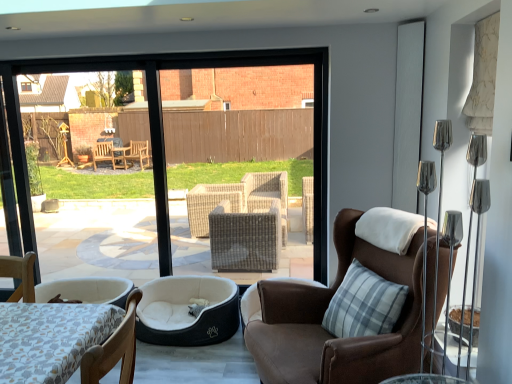
Identify the location of wooden chair at lower left, the 1th chair in the left-to-right sequence. (112, 348).

Image resolution: width=512 pixels, height=384 pixels. I want to click on dark gray plush dog bed at lower left, so click(x=187, y=311).

Is white textured screen door at upper right with brown leather chair at center, marked as the first chair in a back-to-front arrangement?

No, white textured screen door at upper right is not in contact with brown leather chair at center, marked as the first chair in a back-to-front arrangement.

Does white textured screen door at upper right have a larger size compared to brown leather chair at center, arranged as the 2th chair when viewed from the front?

Incorrect, white textured screen door at upper right is not larger than brown leather chair at center, arranged as the 2th chair when viewed from the front.

In the image, is white textured screen door at upper right positioned in front of or behind brown leather chair at center, which is counted as the second chair, starting from the left?

In the image, white textured screen door at upper right appears behind brown leather chair at center, which is counted as the second chair, starting from the left.

How many degrees apart are the facing directions of white textured screen door at upper right and brown leather chair at center, which is counted as the second chair, starting from the left?

The facing directions of white textured screen door at upper right and brown leather chair at center, which is counted as the second chair, starting from the left, are 18.2 degrees apart.

Does wooden chair at lower left, the 1th chair viewed from the front, contain brown leather chair at center, marked as the first chair in a back-to-front arrangement?

No, wooden chair at lower left, the 1th chair viewed from the front, does not contain brown leather chair at center, marked as the first chair in a back-to-front arrangement.

Who is smaller, wooden chair at lower left, the 2th chair positioned from the right, or brown leather chair at center, arranged as the first chair when viewed from the right?

wooden chair at lower left, the 2th chair positioned from the right.

Where is `chair above the brown leather chair at center, which is counted as the second chair, starting from the left (from a real-world perspective)`? chair above the brown leather chair at center, which is counted as the second chair, starting from the left (from a real-world perspective) is located at coordinates (112, 348).

Is white textured screen door at upper right in front of wooden chair at lower left, the 2th chair positioned from the back?

No, it is not.

At what (x,y) coordinates should I click in order to perform the action: click on the 2nd chair in front of the white textured screen door at upper right, starting your count from the anchor. Please return your answer as a coordinate pair (x, y). The image size is (512, 384). Looking at the image, I should click on (112, 348).

Which object is thinner, white textured screen door at upper right or wooden chair at lower left, the 2th chair positioned from the back?

white textured screen door at upper right.

Is white textured screen door at upper right placed right next to dark gray plush dog bed at lower left?

No.

From the image's perspective, is white textured screen door at upper right below dark gray plush dog bed at lower left?

Actually, white textured screen door at upper right appears above dark gray plush dog bed at lower left in the image.

Considering the relative positions of white textured screen door at upper right and dark gray plush dog bed at lower left in the image provided, is white textured screen door at upper right to the right of dark gray plush dog bed at lower left from the viewer's perspective?

Yes.

In the image, is white textured screen door at upper right positioned in front of or behind dark gray plush dog bed at lower left?

Clearly, white textured screen door at upper right is in front of dark gray plush dog bed at lower left.

Is dark gray plush dog bed at lower left wider than wooden chair at lower left, the 1th chair in the left-to-right sequence?

Correct, the width of dark gray plush dog bed at lower left exceeds that of wooden chair at lower left, the 1th chair in the left-to-right sequence.

Which object is positioned more to the right, dark gray plush dog bed at lower left or wooden chair at lower left, the 1th chair in the left-to-right sequence?

dark gray plush dog bed at lower left.

Locate an element on the screen. The width and height of the screenshot is (512, 384). the 2nd chair in front of the dark gray plush dog bed at lower left is located at coordinates (112, 348).

From the image's perspective, relative to wooden chair at lower left, the 1th chair in the left-to-right sequence, is dark gray plush dog bed at lower left above or below?

Clearly, from the image's perspective, dark gray plush dog bed at lower left is below wooden chair at lower left, the 1th chair in the left-to-right sequence.

Find the location of a particular element. chair that is the 2nd one when counting forward from the dark gray plush dog bed at lower left is located at coordinates (112, 348).

From a real-world perspective, does wooden chair at lower left, the 1th chair viewed from the front, stand above dark gray plush dog bed at lower left?

Yes, from a real-world perspective, wooden chair at lower left, the 1th chair viewed from the front, is over dark gray plush dog bed at lower left

Which is more to the right, wooden chair at lower left, the 1th chair viewed from the front, or dark gray plush dog bed at lower left?

Positioned to the right is dark gray plush dog bed at lower left.

Which object is closer to the camera taking this photo, wooden chair at lower left, the 1th chair in the left-to-right sequence, or dark gray plush dog bed at lower left?

wooden chair at lower left, the 1th chair in the left-to-right sequence, is more forward.

Can we say brown leather chair at center, arranged as the 2th chair when viewed from the front, lies outside white textured screen door at upper right?

Absolutely, brown leather chair at center, arranged as the 2th chair when viewed from the front, is external to white textured screen door at upper right.

From the image's perspective, relative to white textured screen door at upper right, is brown leather chair at center, arranged as the 2th chair when viewed from the front, above or below?

brown leather chair at center, arranged as the 2th chair when viewed from the front, is below white textured screen door at upper right.

Considering their positions, is brown leather chair at center, marked as the first chair in a back-to-front arrangement, located in front of or behind white textured screen door at upper right?

Clearly, brown leather chair at center, marked as the first chair in a back-to-front arrangement, is in front of white textured screen door at upper right.

How distant is brown leather chair at center, marked as the first chair in a back-to-front arrangement, from white textured screen door at upper right?

brown leather chair at center, marked as the first chair in a back-to-front arrangement, and white textured screen door at upper right are 1.09 meters apart from each other.

Where is `the 1st chair counting from the left of the white textured screen door at upper right`? the 1st chair counting from the left of the white textured screen door at upper right is located at coordinates (323, 316).

At what (x,y) coordinates should I click in order to perform the action: click on chair in front of the brown leather chair at center, arranged as the 2th chair when viewed from the front. Please return your answer as a coordinate pair (x, y). Looking at the image, I should click on (112, 348).

Considering their positions, is dark gray plush dog bed at lower left positioned further to wooden chair at lower left, the 2th chair positioned from the right, than brown leather chair at center, arranged as the first chair when viewed from the right?

Based on the image, dark gray plush dog bed at lower left appears to be further to wooden chair at lower left, the 2th chair positioned from the right.

Looking at the image, which one is located closer to dark gray plush dog bed at lower left, wooden chair at lower left, the 1th chair in the left-to-right sequence, or white textured screen door at upper right?

Among the two, wooden chair at lower left, the 1th chair in the left-to-right sequence, is located nearer to dark gray plush dog bed at lower left.

Considering their positions, is dark gray plush dog bed at lower left positioned further to brown leather chair at center, which is counted as the second chair, starting from the left, than white textured screen door at upper right?

The object further to brown leather chair at center, which is counted as the second chair, starting from the left, is white textured screen door at upper right.

Which object lies nearer to the anchor point white textured screen door at upper right, brown leather chair at center, arranged as the first chair when viewed from the right, or wooden chair at lower left, the 1th chair viewed from the front?

Based on the image, brown leather chair at center, arranged as the first chair when viewed from the right, appears to be nearer to white textured screen door at upper right.

When comparing their distances from brown leather chair at center, arranged as the first chair when viewed from the right, does dark gray plush dog bed at lower left or wooden chair at lower left, the 1th chair in the left-to-right sequence, seem further?

The object further to brown leather chair at center, arranged as the first chair when viewed from the right, is dark gray plush dog bed at lower left.

Which object lies nearer to the anchor point wooden chair at lower left, the 1th chair viewed from the front, white textured screen door at upper right or dark gray plush dog bed at lower left?

dark gray plush dog bed at lower left is positioned closer to the anchor wooden chair at lower left, the 1th chair viewed from the front.

Based on their spatial positions, is wooden chair at lower left, the 2th chair positioned from the right, or brown leather chair at center, which is counted as the second chair, starting from the left, further from dark gray plush dog bed at lower left?

Among the two, wooden chair at lower left, the 2th chair positioned from the right, is located further to dark gray plush dog bed at lower left.

When comparing their distances from dark gray plush dog bed at lower left, does white textured screen door at upper right or brown leather chair at center, marked as the first chair in a back-to-front arrangement, seem closer?

brown leather chair at center, marked as the first chair in a back-to-front arrangement.

Image resolution: width=512 pixels, height=384 pixels. Identify the location of dog bed situated between wooden chair at lower left, the 2th chair positioned from the right, and white textured screen door at upper right from left to right. (187, 311).

Identify the location of chair located between wooden chair at lower left, the 1th chair viewed from the front, and white textured screen door at upper right in the left-right direction. Image resolution: width=512 pixels, height=384 pixels. (323, 316).

This screenshot has height=384, width=512. Find the location of `chair situated between dark gray plush dog bed at lower left and white textured screen door at upper right from left to right`. chair situated between dark gray plush dog bed at lower left and white textured screen door at upper right from left to right is located at coordinates (323, 316).

Find the location of a particular element. This screenshot has width=512, height=384. chair between wooden chair at lower left, the 2th chair positioned from the back, and dark gray plush dog bed at lower left from front to back is located at coordinates (323, 316).